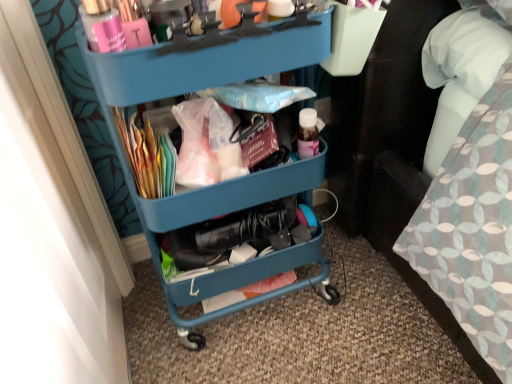
What is the approximate height of teal plastic cart at center?

30.12 inches.

What do you see at coordinates (197, 86) in the screenshot?
I see `teal plastic cart at center` at bounding box center [197, 86].

I want to click on teal plastic cart at center, so click(197, 86).

Locate an element on the screen. teal plastic cart at center is located at coordinates 197,86.